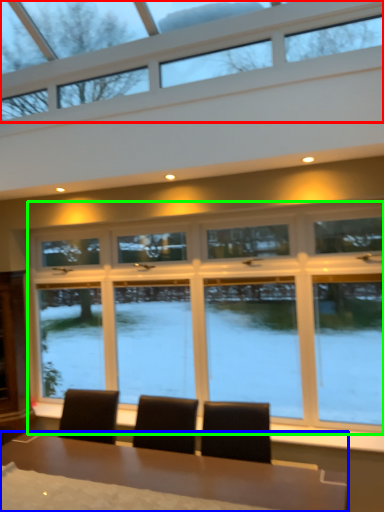
Question: Estimate the real-world distances between objects in this image. Which object is closer to window (highlighted by a red box), table (highlighted by a blue box) or window (highlighted by a green box)?

Choices:
 (A) table
 (B) window

Answer: (B)